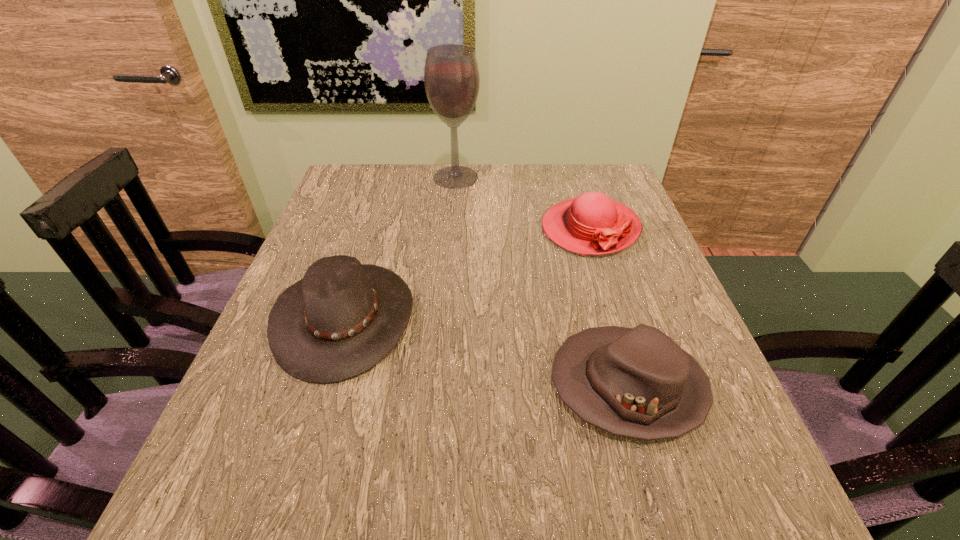
Locate an element on the screen. the tallest object is located at coordinates (451, 76).

Locate an element on the screen. This screenshot has height=540, width=960. alcohol is located at coordinates (451, 76).

I want to click on the leftmost hat, so click(343, 318).

This screenshot has width=960, height=540. I want to click on the third nearest object, so click(591, 224).

I want to click on vacant space located 0.140m on the left of the alcohol, so click(x=384, y=177).

Identify the location of vacant space situated 0.190m on the front-facing side of the leftmost hat. Image resolution: width=960 pixels, height=540 pixels. (509, 318).

Where is `free space located 0.220m at the front of the farthest hat with a bow`? free space located 0.220m at the front of the farthest hat with a bow is located at coordinates (622, 333).

You are a GUI agent. You are given a task and a screenshot of the screen. Output one action in this format:
    pyautogui.click(x=<x>, y=<y>)
    Task: Click on the alcohol present at the far edge
    Image resolution: width=960 pixels, height=540 pixels.
    Given the screenshot: What is the action you would take?
    pyautogui.click(x=451, y=76)

Find the location of `hat that is positioned at the far edge`. hat that is positioned at the far edge is located at coordinates (591, 224).

Where is `object at the left edge`? object at the left edge is located at coordinates (343, 318).